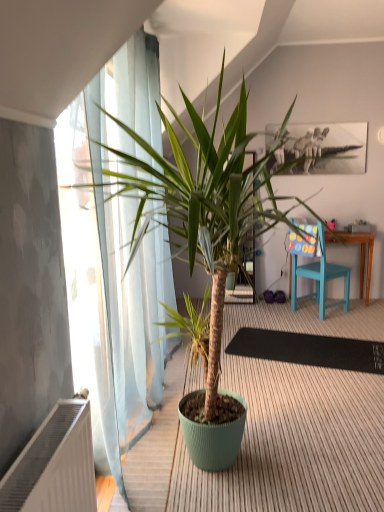
Question: Is black rubber mat at center positioned with its back to white plastic radiator at lower left?

Choices:
 (A) yes
 (B) no

Answer: (B)

Question: Does black rubber mat at center turn towards white plastic radiator at lower left?

Choices:
 (A) no
 (B) yes

Answer: (A)

Question: Is black rubber mat at center not near white plastic radiator at lower left?

Choices:
 (A) no
 (B) yes

Answer: (B)

Question: Can you confirm if black rubber mat at center is wider than white plastic radiator at lower left?

Choices:
 (A) yes
 (B) no

Answer: (A)

Question: Considering the relative sizes of black rubber mat at center and white plastic radiator at lower left in the image provided, is black rubber mat at center thinner than white plastic radiator at lower left?

Choices:
 (A) no
 (B) yes

Answer: (A)

Question: Is black rubber mat at center beside white plastic radiator at lower left?

Choices:
 (A) yes
 (B) no

Answer: (B)

Question: Is green matte plant pot at center aimed at black rubber mat at center?

Choices:
 (A) yes
 (B) no

Answer: (B)

Question: Is the surface of green matte plant pot at center in direct contact with black rubber mat at center?

Choices:
 (A) no
 (B) yes

Answer: (A)

Question: Is green matte plant pot at center far away from black rubber mat at center?

Choices:
 (A) no
 (B) yes

Answer: (B)

Question: Considering the relative sizes of green matte plant pot at center and black rubber mat at center in the image provided, is green matte plant pot at center shorter than black rubber mat at center?

Choices:
 (A) yes
 (B) no

Answer: (B)

Question: Does green matte plant pot at center have a lesser width compared to black rubber mat at center?

Choices:
 (A) no
 (B) yes

Answer: (B)

Question: From the image's perspective, is green matte plant pot at center located beneath black rubber mat at center?

Choices:
 (A) yes
 (B) no

Answer: (B)

Question: From a real-world perspective, is white plastic radiator at lower left on green matte plant pot at center?

Choices:
 (A) no
 (B) yes

Answer: (A)